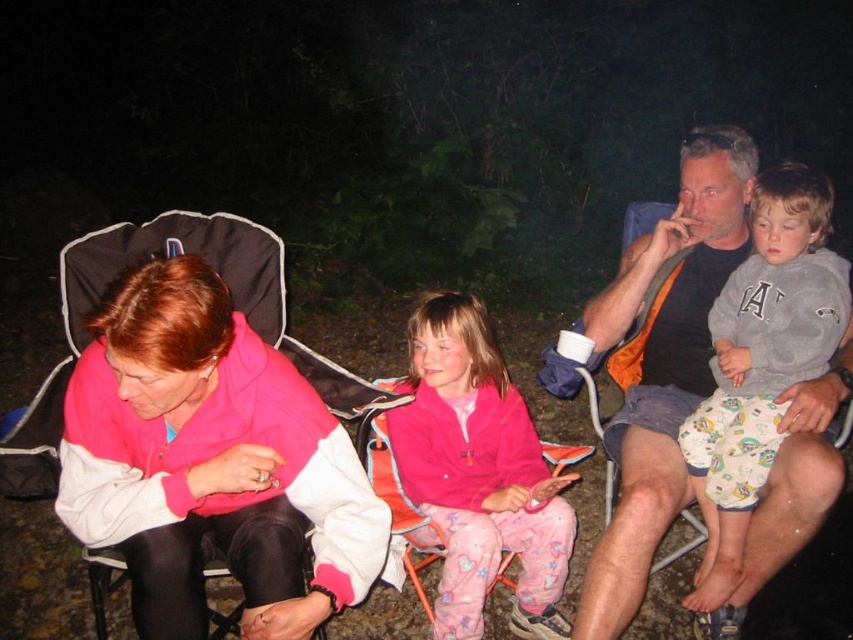
Question: Which of the following is the farthest from the observer?

Choices:
 (A) gray cotton sweatshirt at upper right
 (B) pink fleece jacket at left

Answer: (A)

Question: Where is pink fleece jacket at center located in relation to gray cotton sweatshirt at upper right in the image?

Choices:
 (A) below
 (B) above

Answer: (A)

Question: Among these objects, which one is farthest from the camera?

Choices:
 (A) gray cotton sweatshirt at upper right
 (B) pink fleece jacket at center
 (C) pink fleece jacket at left

Answer: (A)

Question: Which object appears farthest from the camera in this image?

Choices:
 (A) pink fleece jacket at center
 (B) gray cotton sweatshirt at upper right
 (C) pink fleece jacket at left

Answer: (B)

Question: In this image, where is pink fleece jacket at center located relative to gray cotton sweatshirt at upper right?

Choices:
 (A) above
 (B) below

Answer: (B)

Question: Where is pink fleece jacket at left located in relation to pink fleece jacket at center in the image?

Choices:
 (A) below
 (B) above

Answer: (B)